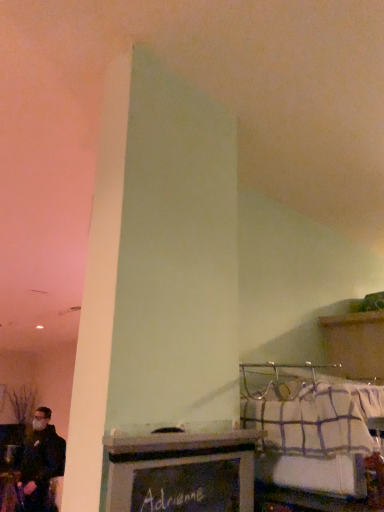
This screenshot has height=512, width=384. What do you see at coordinates (181, 472) in the screenshot?
I see `metallic silver tray at center` at bounding box center [181, 472].

Measure the distance between point [218,482] and camera.

Point [218,482] and camera are 24.69 inches apart.

Where is `metallic silver tray at center`? The image size is (384, 512). metallic silver tray at center is located at coordinates (181, 472).

Locate an element on the screen. white checkered fabric at lower right is located at coordinates (310, 426).

What do you see at coordinates (310, 426) in the screenshot?
I see `white checkered fabric at lower right` at bounding box center [310, 426].

Find the location of a particular element. The width and height of the screenshot is (384, 512). metallic silver tray at center is located at coordinates (181, 472).

Visually, is metallic silver tray at center positioned to the left or to the right of white checkered fabric at lower right?

In the image, metallic silver tray at center appears on the left side of white checkered fabric at lower right.

Considering the positions of objects metallic silver tray at center and white checkered fabric at lower right in the image provided, who is behind, metallic silver tray at center or white checkered fabric at lower right?

white checkered fabric at lower right is behind.

Which is behind, point (132, 496) or point (289, 375)?

The point (289, 375) is behind.

From the image's perspective, which one is positioned lower, metallic silver tray at center or white checkered fabric at lower right?

metallic silver tray at center appears lower in the image.

From a real-world perspective, which is physically above, metallic silver tray at center or white checkered fabric at lower right?

In real-world perspective, white checkered fabric at lower right is above.

From the picture: Considering the sizes of objects metallic silver tray at center and white checkered fabric at lower right in the image provided, who is wider, metallic silver tray at center or white checkered fabric at lower right?

white checkered fabric at lower right is wider.

Is metallic silver tray at center taller than white checkered fabric at lower right?

Correct, metallic silver tray at center is much taller as white checkered fabric at lower right.

Can you confirm if metallic silver tray at center is smaller than white checkered fabric at lower right?

Yes.

Is metallic silver tray at center not inside white checkered fabric at lower right?

Yes, metallic silver tray at center is outside of white checkered fabric at lower right.

Is metallic silver tray at center positioned far away from white checkered fabric at lower right?

No, metallic silver tray at center is not far away from white checkered fabric at lower right.

Is metallic silver tray at center positioned with its back to white checkered fabric at lower right?

metallic silver tray at center does not have its back to white checkered fabric at lower right.

Consider the image. How many degrees apart are the facing directions of metallic silver tray at center and white checkered fabric at lower right?

0.0876 degrees.

This screenshot has height=512, width=384. What are the coordinates of `bed above the metallic silver tray at center (from the image's perspective)` in the screenshot? It's located at (310, 426).

In the image, is white checkered fabric at lower right on the left side or the right side of metallic silver tray at center?

From the image, it's evident that white checkered fabric at lower right is to the right of metallic silver tray at center.

Is white checkered fabric at lower right further to camera compared to metallic silver tray at center?

Yes, white checkered fabric at lower right is further from the viewer.

Is point (303, 452) positioned in front of point (141, 476)?

That is False.

From the image's perspective, is white checkered fabric at lower right on metallic silver tray at center?

Indeed, from the image's perspective, white checkered fabric at lower right is shown above metallic silver tray at center.

From a real-world perspective, does white checkered fabric at lower right sit lower than metallic silver tray at center?

No, from a real-world perspective, white checkered fabric at lower right is not under metallic silver tray at center.

In terms of width, does white checkered fabric at lower right look wider or thinner when compared to metallic silver tray at center?

white checkered fabric at lower right is wider than metallic silver tray at center.

From the picture: Which of these two, white checkered fabric at lower right or metallic silver tray at center, stands shorter?

Standing shorter between the two is white checkered fabric at lower right.

Considering the sizes of objects white checkered fabric at lower right and metallic silver tray at center in the image provided, who is smaller, white checkered fabric at lower right or metallic silver tray at center?

Smaller between the two is metallic silver tray at center.

Would you say white checkered fabric at lower right is inside or outside metallic silver tray at center?

white checkered fabric at lower right is spatially situated outside metallic silver tray at center.

Is white checkered fabric at lower right positioned far away from metallic silver tray at center?

Actually, white checkered fabric at lower right and metallic silver tray at center are a little close together.

Is white checkered fabric at lower right facing away from metallic silver tray at center?

No, white checkered fabric at lower right's orientation is not away from metallic silver tray at center.

In the scene shown: How many degrees apart are the facing directions of white checkered fabric at lower right and metallic silver tray at center?

0.0876 degrees.

Find the location of a particular element. This screenshot has height=512, width=384. bed behind the metallic silver tray at center is located at coordinates (310, 426).

Locate an element on the screen. bed lying on the right of metallic silver tray at center is located at coordinates (310, 426).

Find the location of a particular element. This screenshot has width=384, height=512. bed above the metallic silver tray at center (from the image's perspective) is located at coordinates (310, 426).